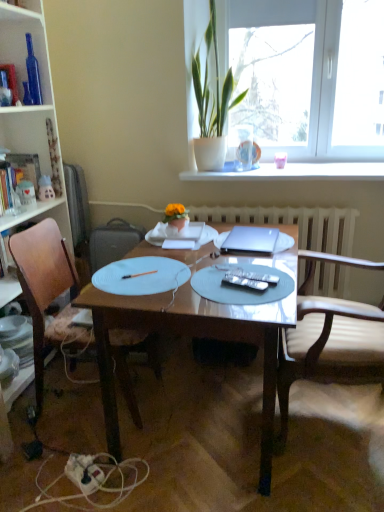
The image size is (384, 512). I want to click on vacant space that is to the left of silver metallic remote control at center, so click(x=200, y=288).